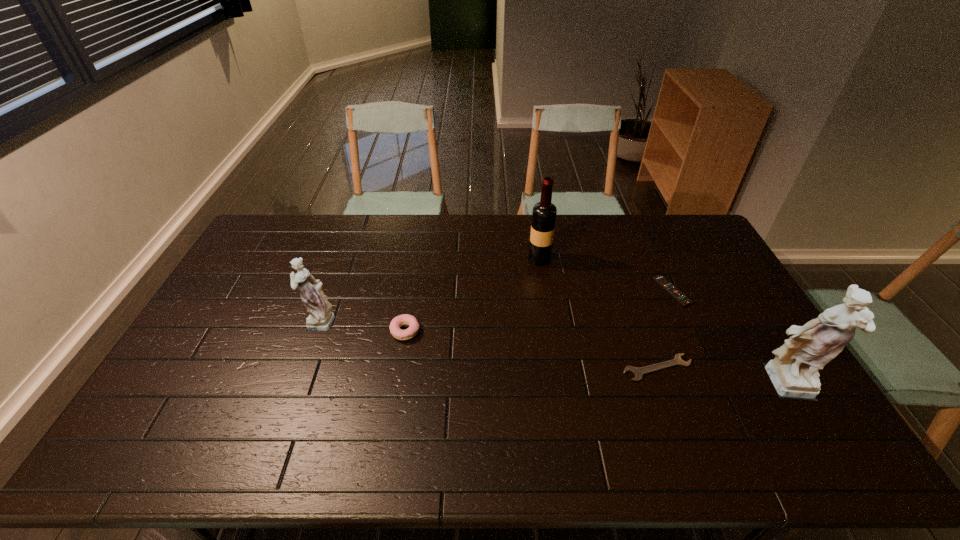
Locate an element on the screen. This screenshot has width=960, height=540. free space located 0.070m on the front-facing side of the third tallest object is located at coordinates tap(279, 321).

At what (x,y) coordinates should I click in order to perform the action: click on vacant space located 0.210m on the front-facing side of the third tallest object. Please return your answer as a coordinate pair (x, y). This screenshot has width=960, height=540. Looking at the image, I should click on (234, 321).

Find the location of a particular element. Image resolution: width=960 pixels, height=540 pixels. vacant space located 0.160m on the front-facing side of the third tallest object is located at coordinates (251, 321).

Where is `vacant region located 0.230m on the back of the second farthest object`? vacant region located 0.230m on the back of the second farthest object is located at coordinates (646, 236).

Identify the location of vacant space located on the right of the third object from left to right. (581, 259).

Where is `vacant space located on the right of the wrench`? vacant space located on the right of the wrench is located at coordinates (755, 368).

Find the location of `vacant space located on the left of the fifth object from right to left`. vacant space located on the left of the fifth object from right to left is located at coordinates (371, 332).

The height and width of the screenshot is (540, 960). I want to click on object that is at the near edge, so click(x=793, y=372).

In order to click on object located at the right edge in this screenshot , I will do `click(793, 372)`.

You are a GUI agent. You are given a task and a screenshot of the screen. Output one action in this format:
    pyautogui.click(x=<x>, y=<y>)
    Task: Click on the object at the near right corner
    This screenshot has height=540, width=960.
    Given the screenshot: What is the action you would take?
    pyautogui.click(x=793, y=372)